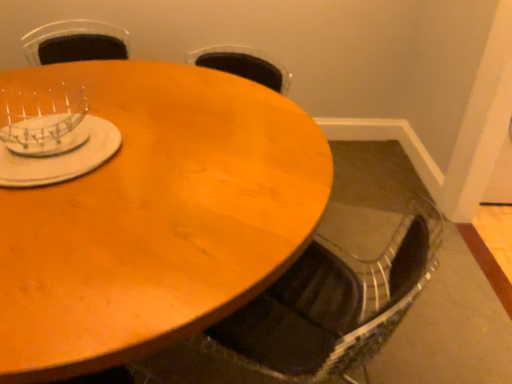
Image resolution: width=512 pixels, height=384 pixels. I want to click on free space behind white matte plate at upper left, which is counted as the first tableware, starting from the bottom, so click(x=115, y=89).